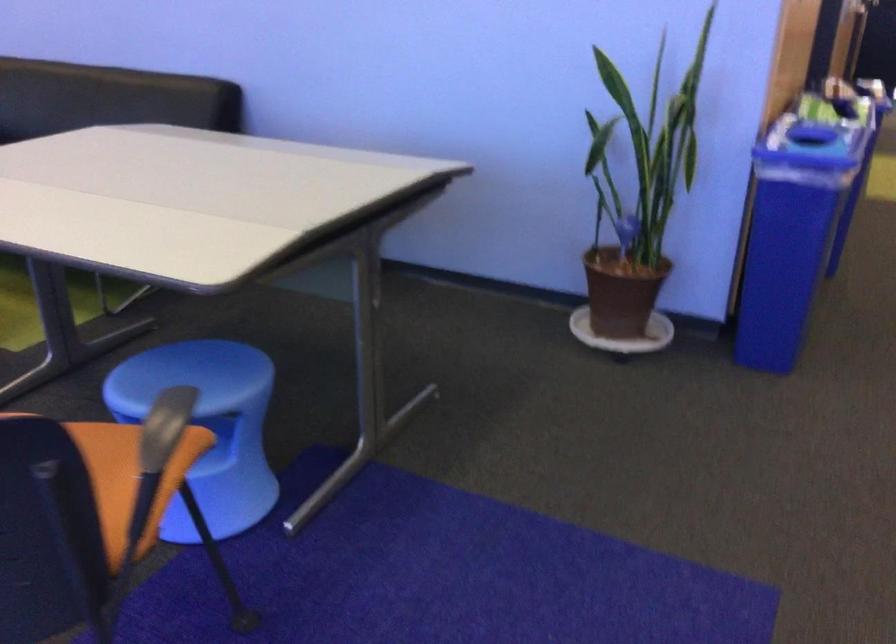
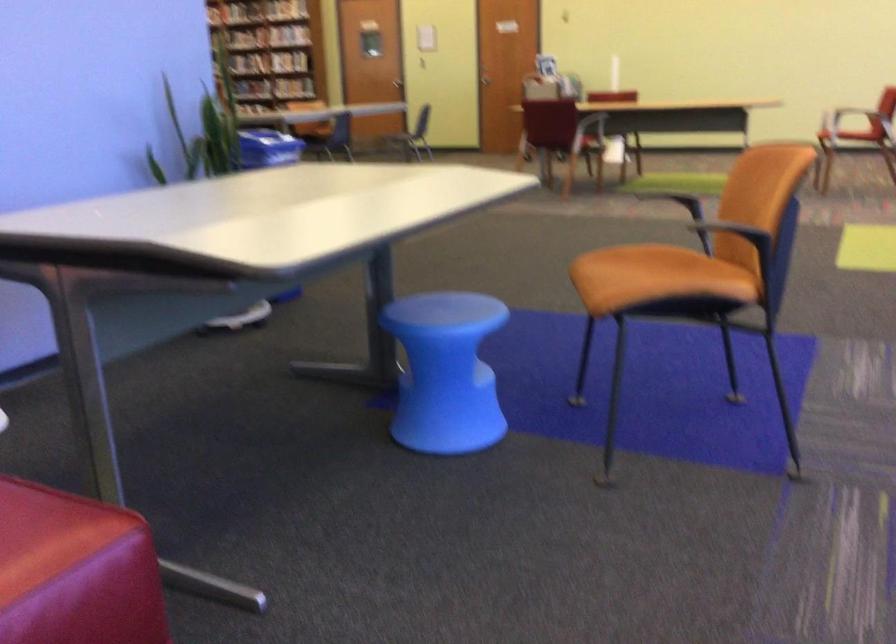
The point at (84, 527) is marked in the first image. Where is the corresponding point in the second image?

(682, 270)